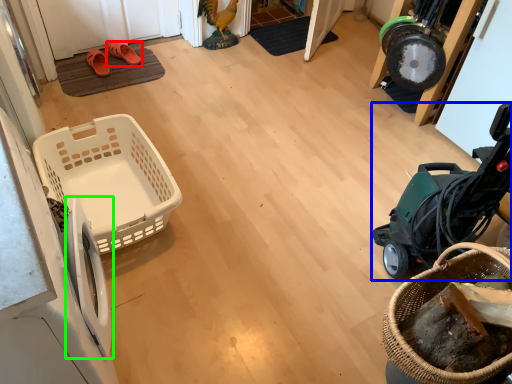
Question: Considering the real-world distances, which object is closest to footwear (highlighted by a red box)? baby carriage (highlighted by a blue box) or washing machine (highlighted by a green box).

Choices:
 (A) baby carriage
 (B) washing machine

Answer: (B)